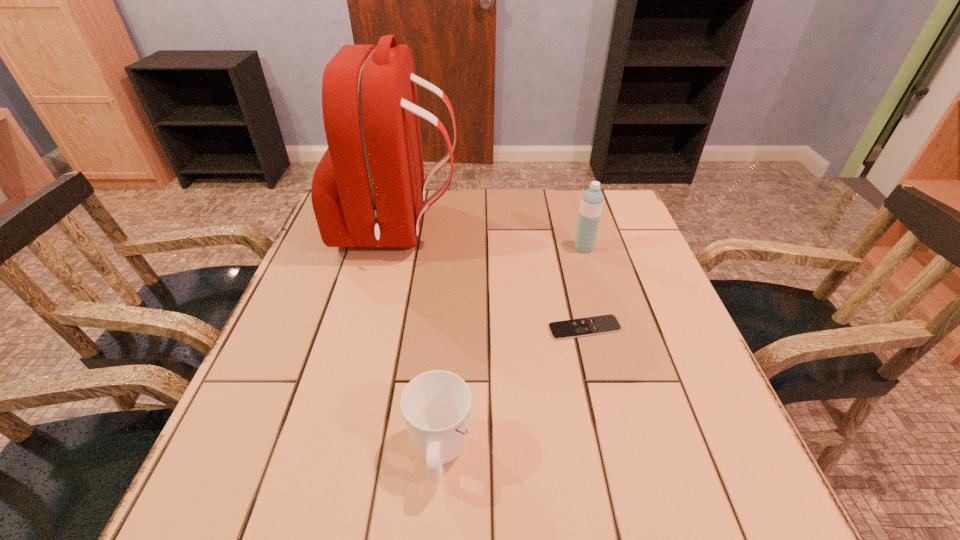
At what (x,y) coordinates should I click in order to perform the action: click on the tallest object. Please return your answer as a coordinate pair (x, y). Looking at the image, I should click on (368, 190).

Where is `the second tallest object`? This screenshot has height=540, width=960. the second tallest object is located at coordinates (592, 200).

Where is `the third tallest object`? the third tallest object is located at coordinates (436, 405).

Where is `the nearest object`? This screenshot has width=960, height=540. the nearest object is located at coordinates (436, 405).

Identify the location of the shortest object. (602, 324).

This screenshot has height=540, width=960. In order to click on remote control in this screenshot , I will do `click(602, 324)`.

Locate an element on the screen. This screenshot has height=540, width=960. free region located 0.330m on the strap side of the tallest object is located at coordinates (577, 230).

I want to click on vacant region located 0.090m on the left of the third shortest object, so click(x=540, y=248).

The image size is (960, 540). I want to click on blank area located 0.380m on the side of the third tallest object with the handle, so click(x=452, y=276).

Locate an element on the screen. free space located 0.320m on the side of the third tallest object with the handle is located at coordinates (451, 293).